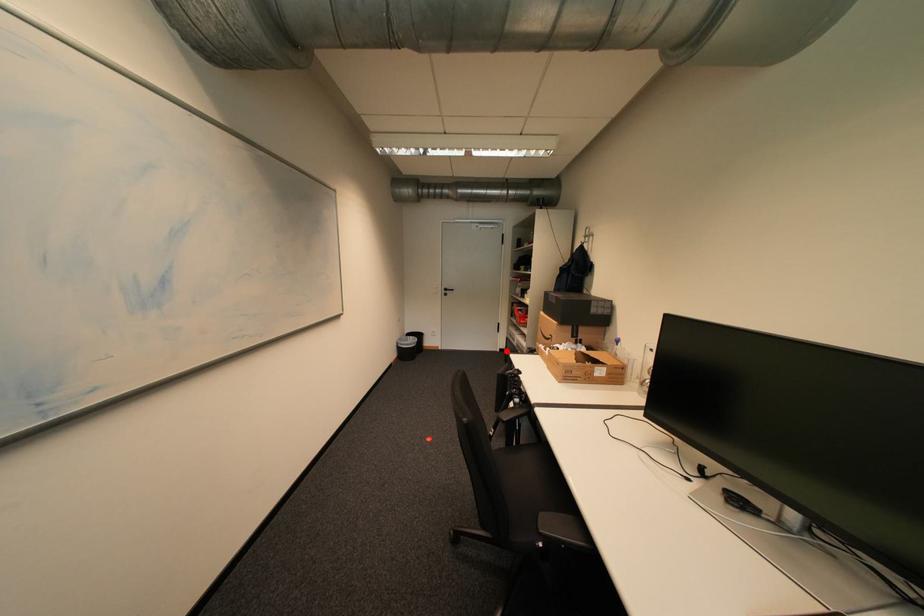
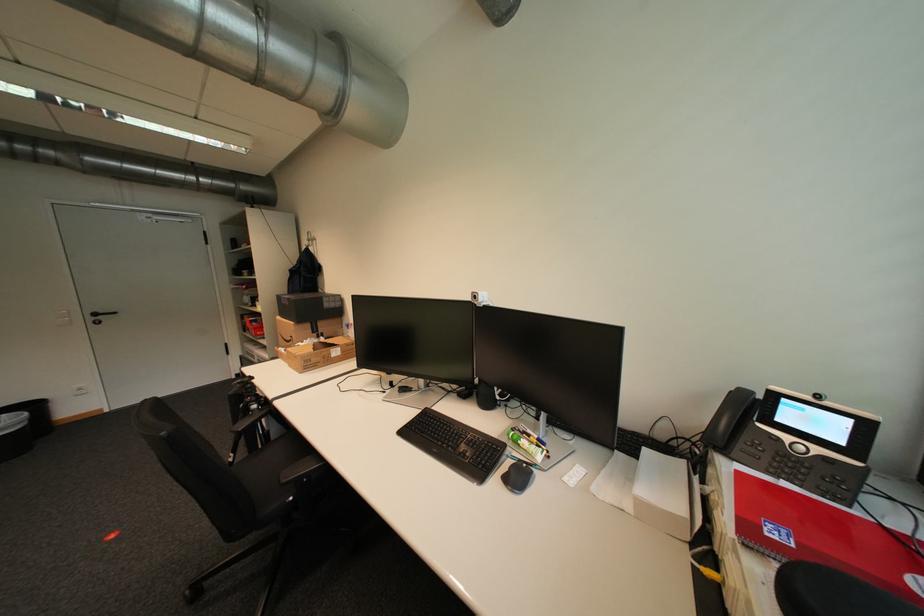
Find the pixel in the second image that matches the highlighted location in the first image.

(242, 378)